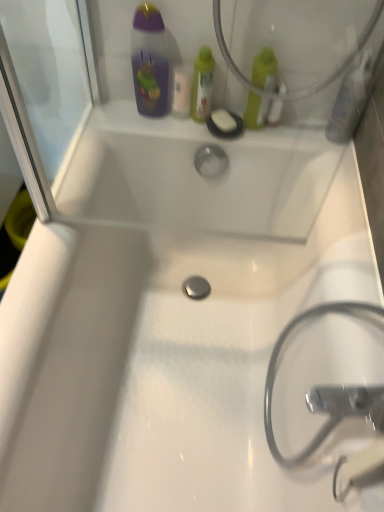
Find the location of a particular element. The width and height of the screenshot is (384, 512). vacant space situated on the left part of translucent plastic mouthwash at upper center, which appears as the fifth mouthwash when viewed from the right is located at coordinates (122, 120).